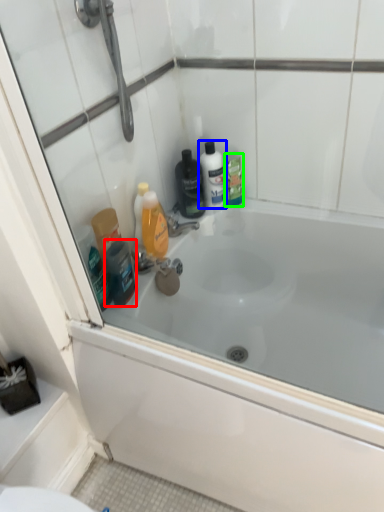
Question: Based on their relative distances, which object is farther from toiletry (highlighted by a red box)? Choose from mouthwash (highlighted by a blue box) and mouthwash (highlighted by a green box).

Choices:
 (A) mouthwash
 (B) mouthwash

Answer: (B)